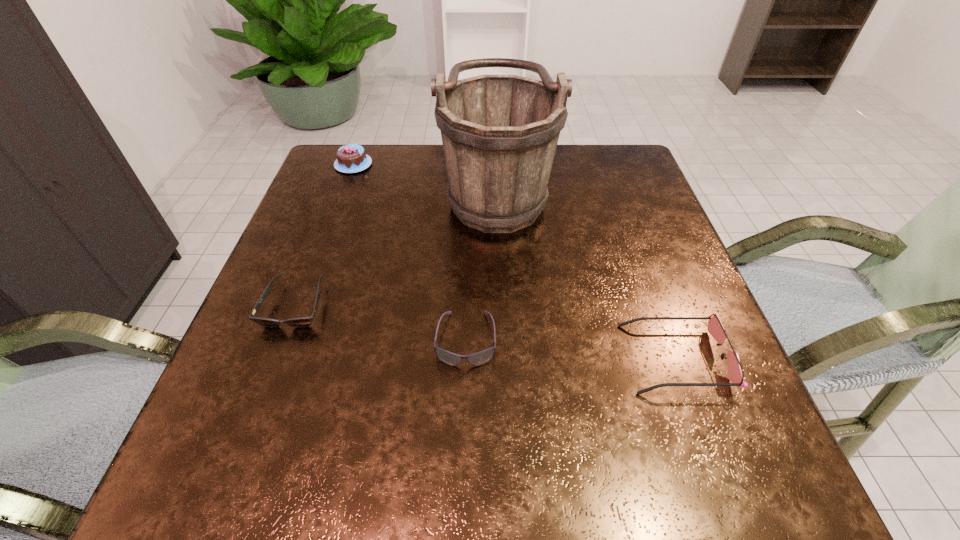
You are a GUI agent. You are given a task and a screenshot of the screen. Output one action in this format:
    pyautogui.click(x=<x>, y=<y>)
    Task: Click on the free region located on the bridge of the rightmost sunglasses
    This screenshot has width=960, height=540.
    Given the screenshot: What is the action you would take?
    pyautogui.click(x=434, y=358)

Image resolution: width=960 pixels, height=540 pixels. In order to click on vacant space situated on the bridge of the rightmost sunglasses in this screenshot , I will do `click(498, 358)`.

The width and height of the screenshot is (960, 540). Identify the location of free spot located 0.120m on the bridge of the rightmost sunglasses. (557, 358).

Locate an element on the screen. Image resolution: width=960 pixels, height=540 pixels. vacant space situated on the lenses of the second sunglasses from left to right is located at coordinates (462, 487).

Where is `free space located on the front-facing side of the leftmost sunglasses`? This screenshot has width=960, height=540. free space located on the front-facing side of the leftmost sunglasses is located at coordinates (222, 498).

The width and height of the screenshot is (960, 540). I want to click on bucket that is at the far edge, so click(x=499, y=133).

The width and height of the screenshot is (960, 540). Find the location of `chocolate cake located at the far edge`. chocolate cake located at the far edge is located at coordinates point(352,158).

Find the location of a particular element. chocolate cake that is at the left edge is located at coordinates (352, 158).

Identify the location of sunglasses at the left edge. (302, 321).

The width and height of the screenshot is (960, 540). I want to click on object that is at the right edge, so click(x=735, y=372).